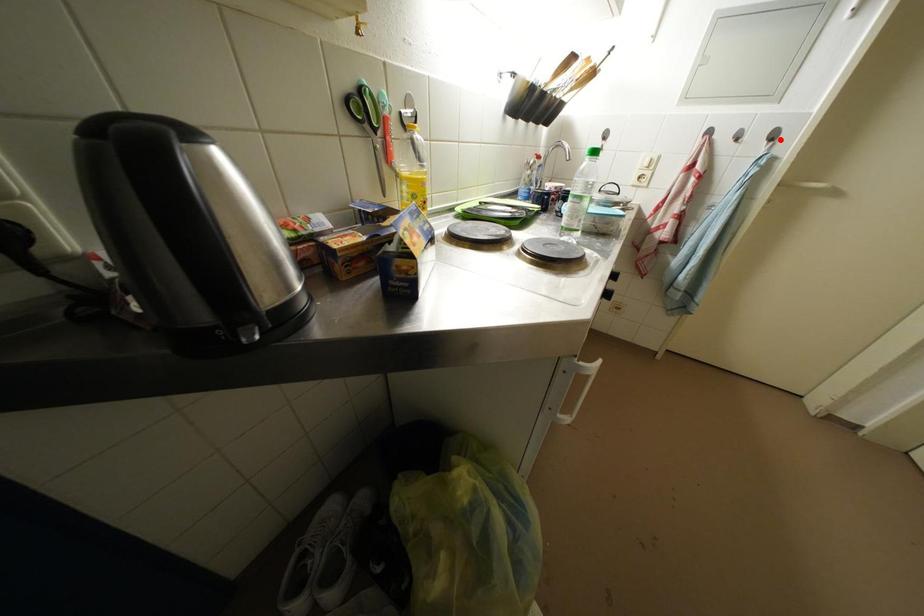
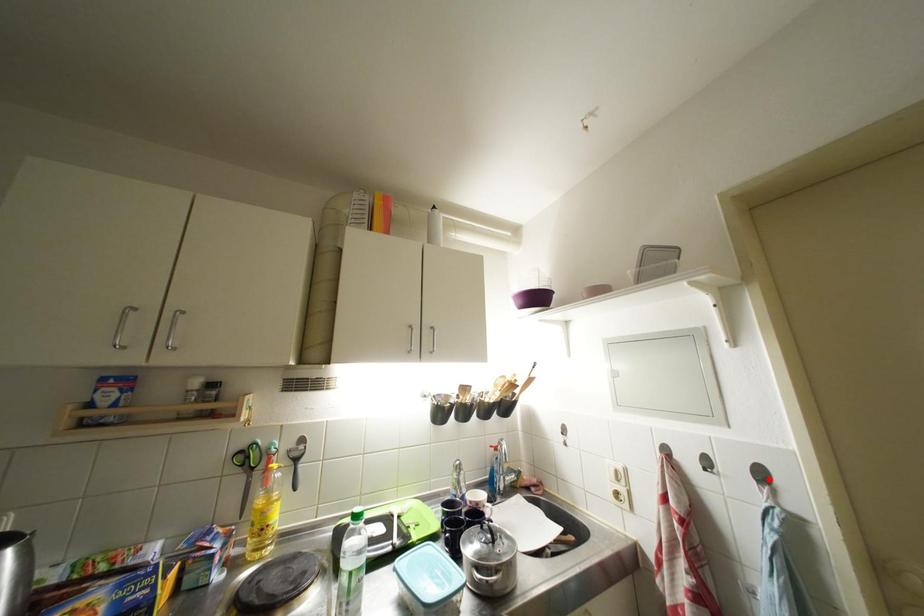
I am providing you with two images of the same scene from different viewpoints. A red point is marked on the first image and another point is marked on the second image. Is the marked point in image1 the same physical position as the marked point in image2?

Yes